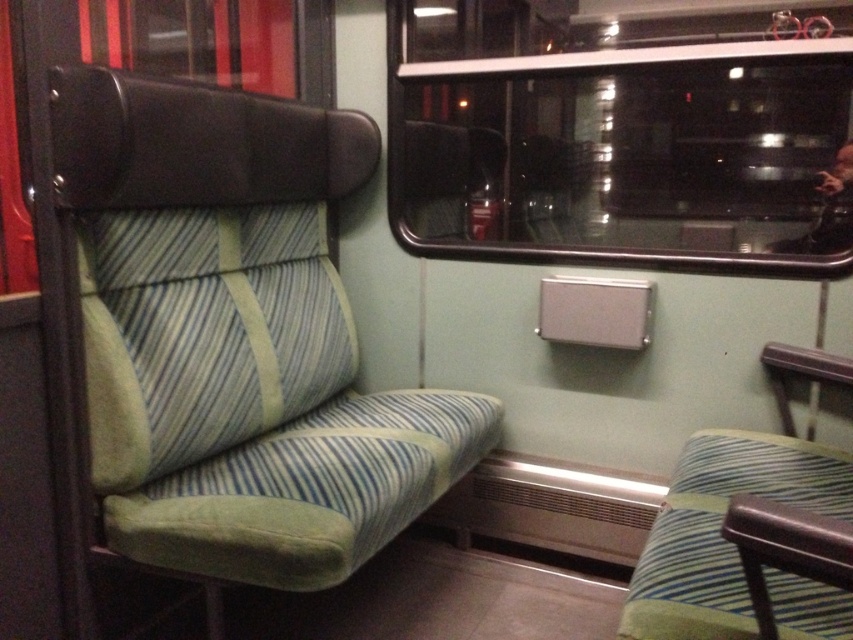
You are a passenger on a train and want to know if you can place a rectangular luggage case between the transparent glass window at upper center and the green striped fabric seat at lower right. The luggage case is 1.2 meters wide. Can you fit it there?

The transparent glass window at upper center might be wider than the green striped fabric seat at lower right, but without exact measurements, it is uncertain whether the space between them can accommodate a 1.2 meter wide luggage case. Check the actual width before placing it.